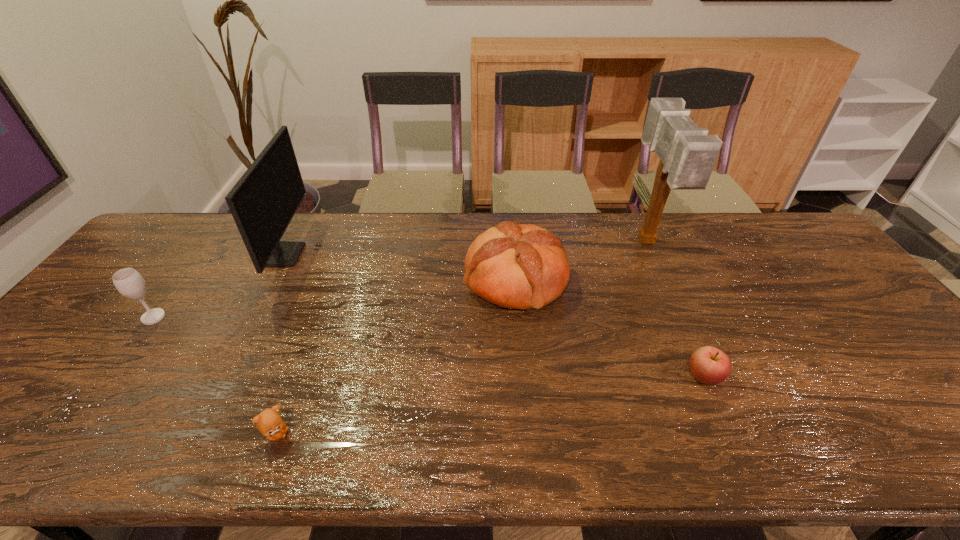
Locate an element on the screen. This screenshot has height=540, width=960. vacant area that lies between the second object from left to right and the fourth object from left to right is located at coordinates (400, 267).

Identify the location of object identified as the fifth closest to the wineglass. The image size is (960, 540). (687, 154).

Locate which object ranks second in proximity to the apple. Please provide its 2D coordinates. Your answer should be formatted as a tuple, i.e. [(x, y)], where the tuple contains the x and y coordinates of a point satisfying the conditions above.

[(687, 154)]

This screenshot has height=540, width=960. I want to click on vacant space that satisfies the following two spatial constraints: 1. on the front-facing side of the second tallest object; 2. on the back side of the bread, so click(x=272, y=280).

The height and width of the screenshot is (540, 960). What are the coordinates of `vacant region that satisfies the following two spatial constraints: 1. on the front side of the mallet; 2. on the face of the nearest object` in the screenshot? It's located at (733, 434).

The height and width of the screenshot is (540, 960). Identify the location of vacant region that satisfies the following two spatial constraints: 1. on the front-facing side of the apple; 2. on the right side of the computer monitor. (222, 375).

Where is `free location that satisfies the following two spatial constraints: 1. on the back side of the bread; 2. on the front-facing side of the second tallest object`? The width and height of the screenshot is (960, 540). free location that satisfies the following two spatial constraints: 1. on the back side of the bread; 2. on the front-facing side of the second tallest object is located at coordinates (514, 255).

Where is `free space in the image that satisfies the following two spatial constraints: 1. on the front-facing side of the fifth object from right to left; 2. on the back side of the second nearest object`? free space in the image that satisfies the following two spatial constraints: 1. on the front-facing side of the fifth object from right to left; 2. on the back side of the second nearest object is located at coordinates (222, 375).